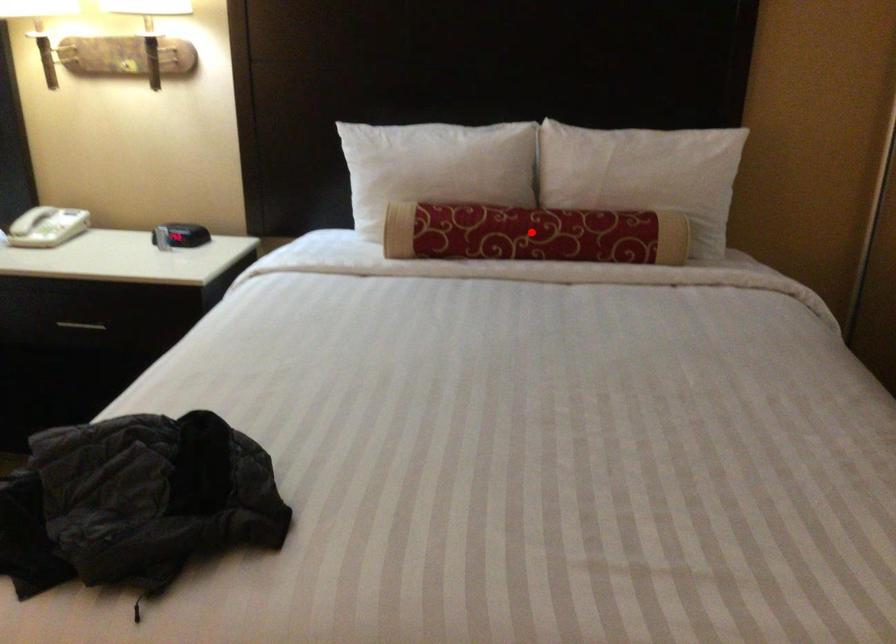
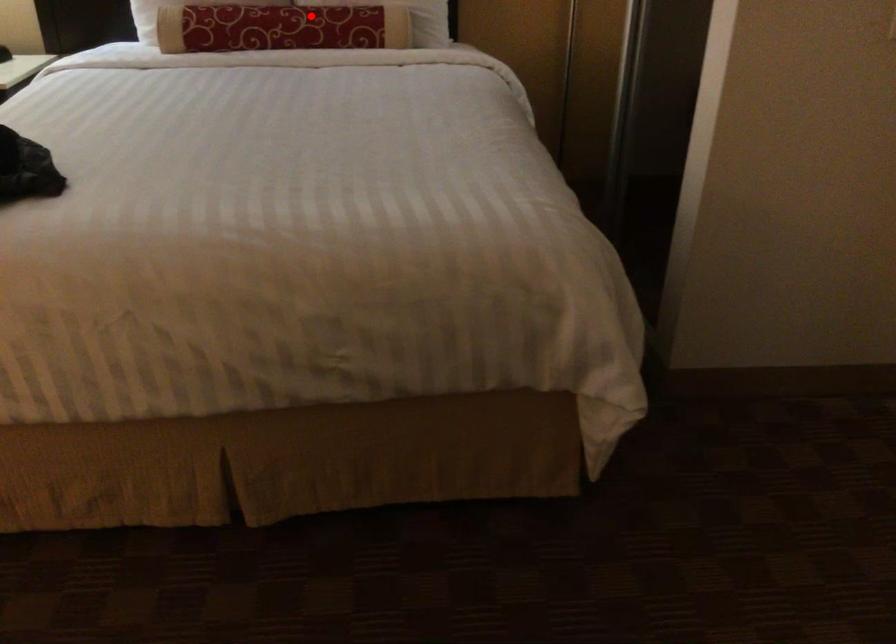
I am providing you with two images of the same scene from different viewpoints. A red point is marked on the first image and another point is marked on the second image. Is the red point in image1 aligned with the point shown in image2?

No